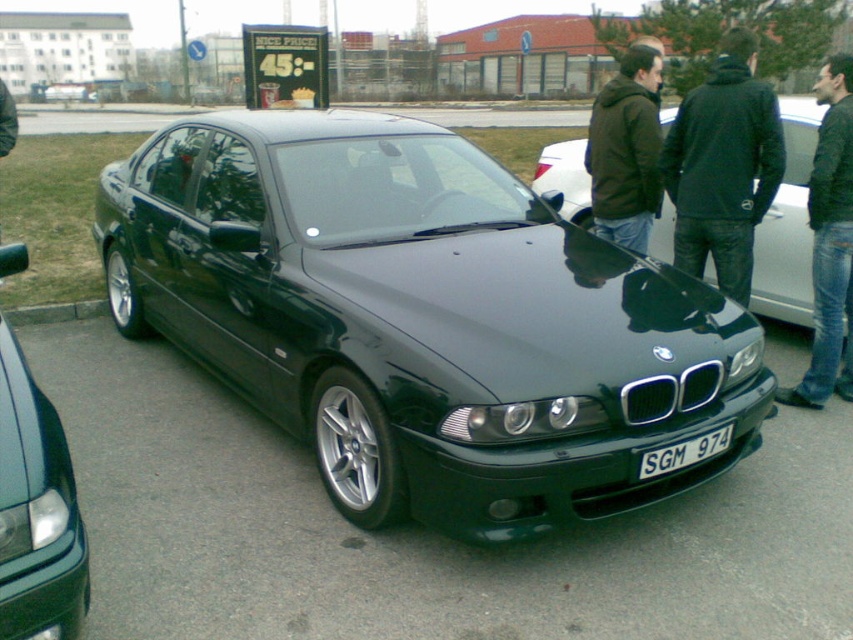
You are a delivery driver who needs to back out of the parking spot where the metallic dark green car at center is parked. There is a person in a dark green jacket at upper right standing behind the car. Can you safely back out without hitting the person?

The metallic dark green car at center is in front of the dark green jacket at upper right, meaning the person is behind the car. Since the car is parked and the jacket is behind it, the driver can safely back out as long as the person remains behind the car and out of the backing path. However, the driver should still check mirrors and surroundings for safety.

You are standing at the gray concrete curb at lower left and want to walk to the metallic dark green car at center. Which direction should you move to reach it?

You should move to your right to reach the metallic dark green car at center since it is positioned to the right of the gray concrete curb at lower left.